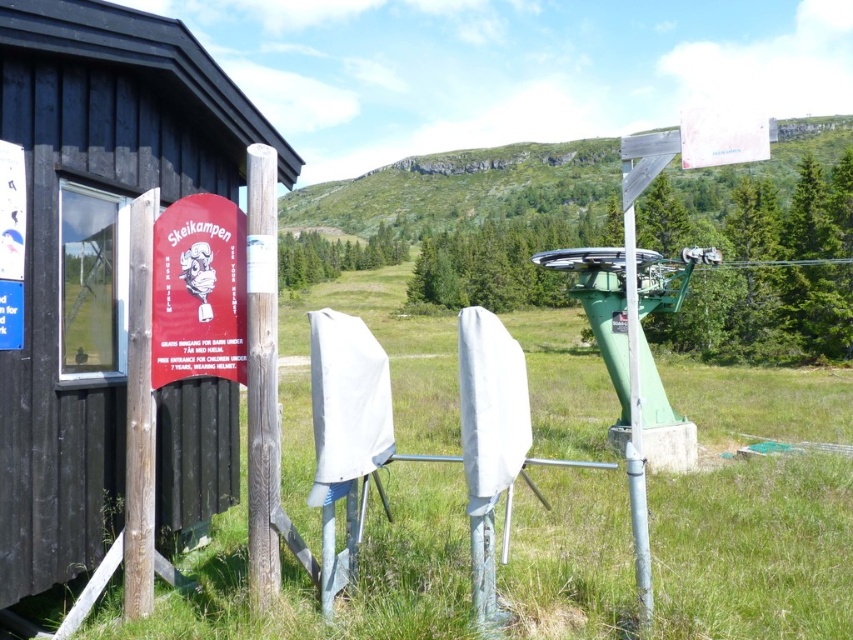
Which is more to the left, red fabric sign at left or metallic pole at right?

From the viewer's perspective, red fabric sign at left appears more on the left side.

Is red fabric sign at left positioned in front of metallic pole at right?

No.

Who is more distant from viewer, (x=184, y=324) or (x=641, y=538)?

The point (x=184, y=324) is more distant.

This screenshot has height=640, width=853. Identify the location of red fabric sign at left. (198, 291).

From the picture: Does black wood hut at left have a larger size compared to metallic pole at right?

Actually, black wood hut at left might be smaller than metallic pole at right.

Based on the photo, who is more distant from viewer, (190,428) or (630,474)?

The point (190,428) is more distant.

Who is more forward, (74, 96) or (647, 570)?

Point (647, 570)

The width and height of the screenshot is (853, 640). What are the coordinates of `black wood hut at left` in the screenshot? It's located at (91, 250).

Between wooden post at left and metallic pole at right, which one has more height?

Standing taller between the two is metallic pole at right.

Find the location of a particular element. Image resolution: width=853 pixels, height=640 pixels. wooden post at left is located at coordinates (262, 374).

Where is `wooden post at left`? wooden post at left is located at coordinates (262, 374).